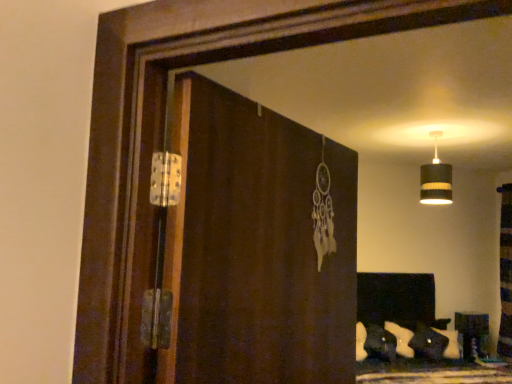
Question: Does point (429, 198) appear closer or farther from the camera than point (460, 337)?

Choices:
 (A) closer
 (B) farther

Answer: (A)

Question: From the image's perspective, relative to wooden bookshelf at right, is black striped lampshade at upper right above or below?

Choices:
 (A) below
 (B) above

Answer: (B)

Question: Which object is the farthest from the brown wooden screen door at center?

Choices:
 (A) black striped lampshade at upper right
 (B) wooden bookshelf at right

Answer: (B)

Question: Which of these objects is positioned closest to the wooden bookshelf at right?

Choices:
 (A) brown wooden screen door at center
 (B) black striped lampshade at upper right

Answer: (B)